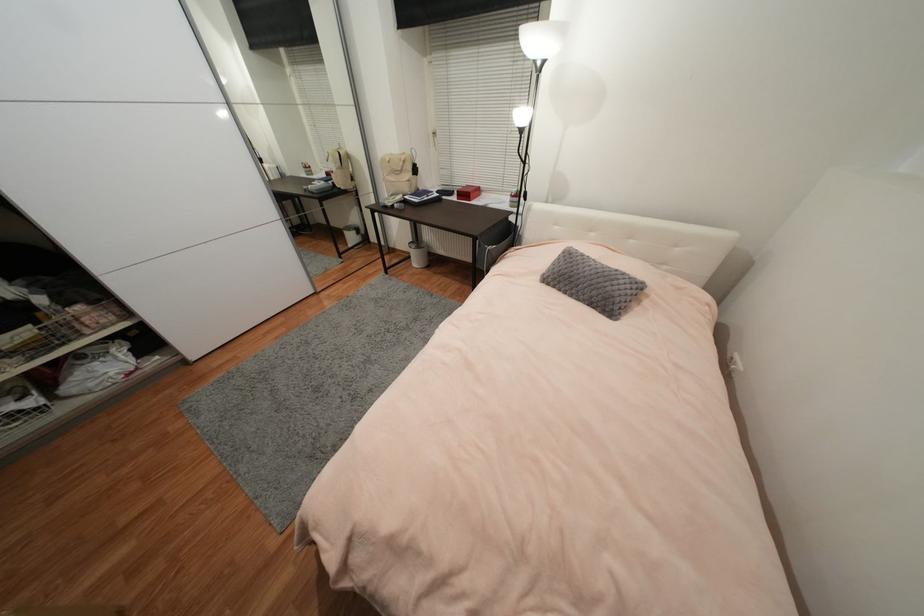
Find where to sit the chair sitting surface. Please return your answer as a coordinate pair (x, y).

(496, 233)